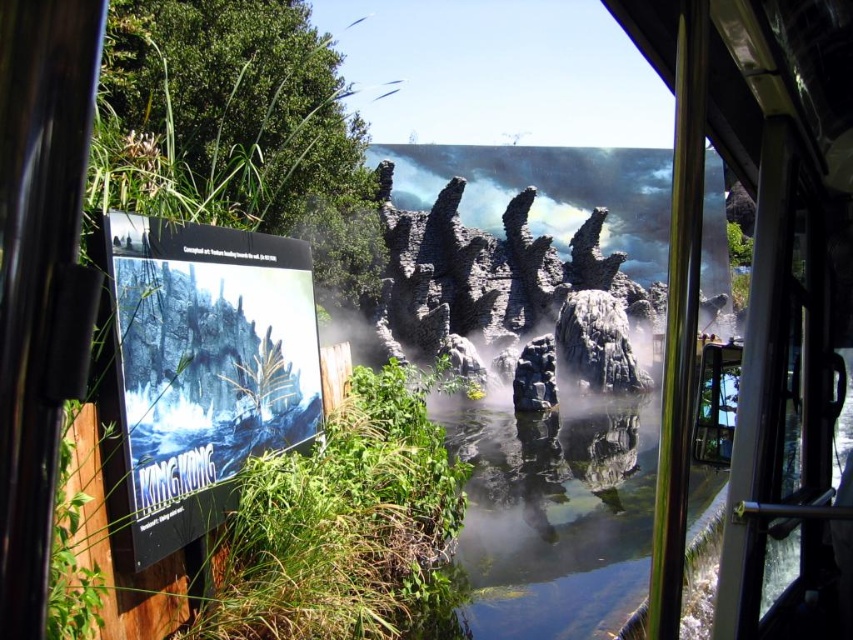
Is clear water at center closer to camera compared to rugged stone rock formation at center?

Yes, clear water at center is closer to the viewer.

Which is below, clear water at center or rugged stone rock formation at center?

clear water at center is lower down.

Is point (601, 572) farther from viewer compared to point (537, 330)?

No, (601, 572) is closer to viewer.

Locate an element on the screen. The image size is (853, 640). clear water at center is located at coordinates (553, 515).

Which is more to the right, green leafy plant at center or rugged stone rock formation at center?

Positioned to the right is rugged stone rock formation at center.

Image resolution: width=853 pixels, height=640 pixels. In order to click on green leafy plant at center in this screenshot , I will do `click(344, 528)`.

Is green leafy plant at center thinner than clear water at center?

Indeed, green leafy plant at center has a lesser width compared to clear water at center.

Which is more to the right, green leafy plant at center or clear water at center?

From the viewer's perspective, clear water at center appears more on the right side.

Is point (288, 480) farther from camera compared to point (577, 612)?

No.

This screenshot has height=640, width=853. Identify the location of green leafy plant at center. (344, 528).